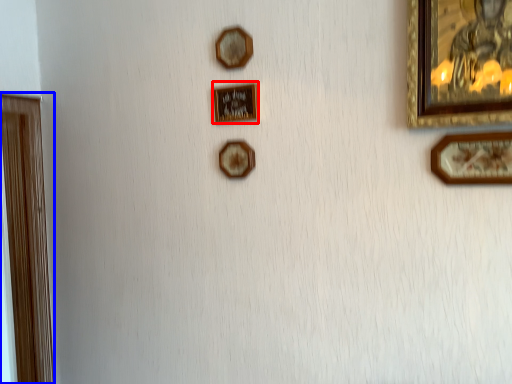
Question: Which point is closer to the camera, picture frame (highlighted by a red box) or picture frame (highlighted by a blue box)?

Choices:
 (A) picture frame
 (B) picture frame

Answer: (A)